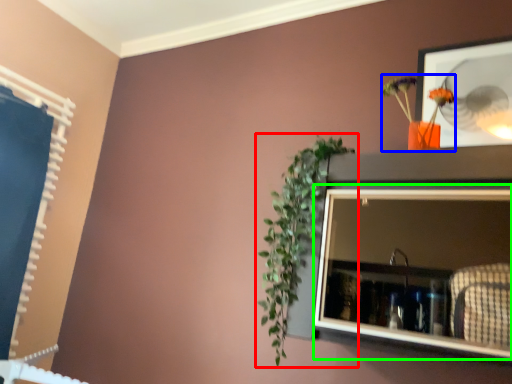
Question: Considering the real-world distances, which object is farthest from houseplant (highlighted by a red box)? floral arrangement (highlighted by a blue box) or medicine cabinet (highlighted by a green box)?

Choices:
 (A) floral arrangement
 (B) medicine cabinet

Answer: (A)